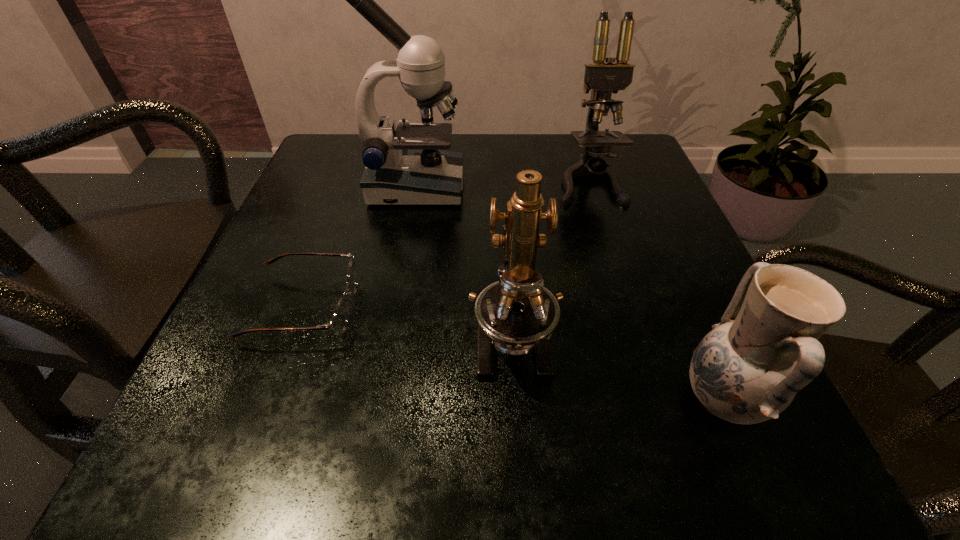
Locate an element on the screen. vacant area that lies between the rightmost microscope and the shortest object is located at coordinates (445, 245).

Identify the location of free space between the tallest microscope and the spectacles. This screenshot has height=540, width=960. (x=359, y=247).

Find the location of a particular element. free space that is in between the third object from right to left and the tallest object is located at coordinates (464, 263).

At what (x,y) coordinates should I click in order to perform the action: click on vacant space that is in between the rightmost microscope and the shortest object. Please return your answer as a coordinate pair (x, y). Looking at the image, I should click on (445, 245).

Locate an element on the screen. The image size is (960, 540). vacant space that is in between the leftmost microscope and the third object from right to left is located at coordinates (464, 263).

At what (x,y) coordinates should I click in order to perform the action: click on vacant space in between the shortest object and the leftmost microscope. Please return your answer as a coordinate pair (x, y). This screenshot has height=540, width=960. Looking at the image, I should click on (359, 247).

The width and height of the screenshot is (960, 540). Identify the location of vacant area between the rightmost microscope and the tallest object. (502, 185).

This screenshot has width=960, height=540. In order to click on free space that is in between the pottery and the rightmost microscope in this screenshot , I will do `click(655, 291)`.

The width and height of the screenshot is (960, 540). In order to click on free spot between the rightmost microscope and the spectacles in this screenshot , I will do `click(445, 245)`.

Where is `object that is the closest to the shortest object`? This screenshot has height=540, width=960. object that is the closest to the shortest object is located at coordinates (407, 165).